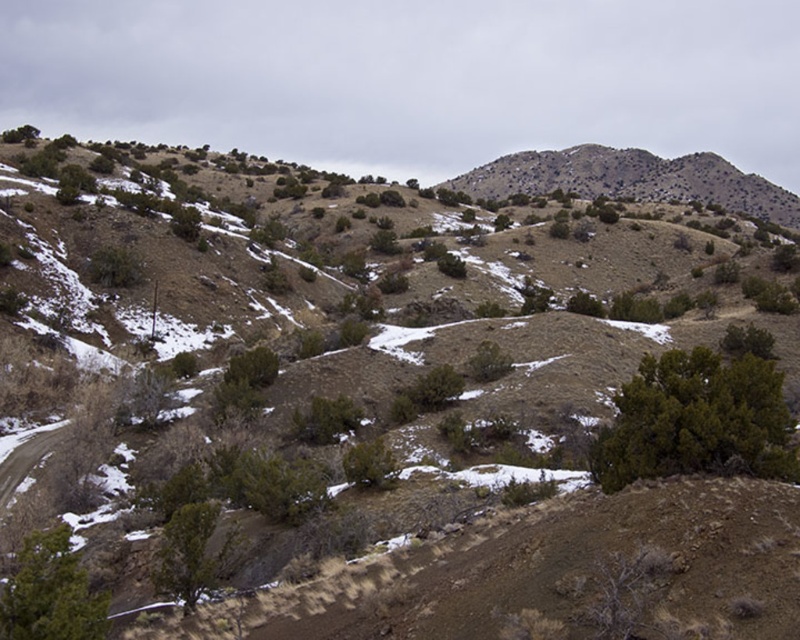
You are a hiker planning to traverse the rugged, hilly landscape shown in the image. You need to decide whether you can step over the green leafy bush at lower right before climbing the desert brown hill at upper right. Can you do it based on their heights?

The green leafy bush at lower right has a lesser height compared to the desert brown hill at upper right, so yes, you can step over the green leafy bush at lower right since it is shorter than the hill.